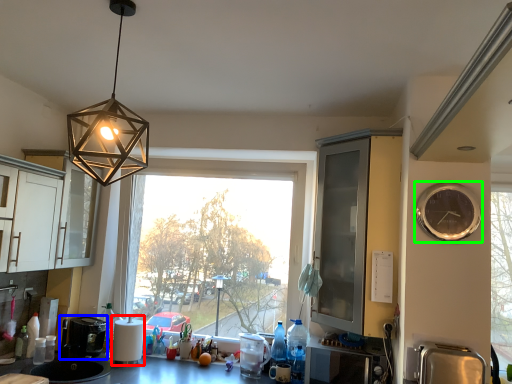
Question: Which object is the farthest from appliance (highlighted by a red box)? Choose among these: coffee machine (highlighted by a blue box) or clock (highlighted by a green box).

Choices:
 (A) coffee machine
 (B) clock

Answer: (B)